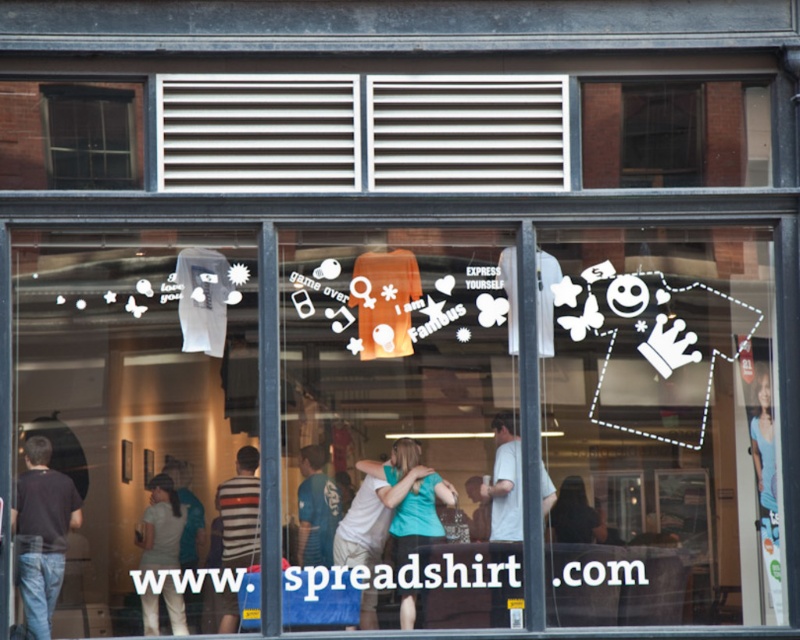
Who is lower down, white cotton shirt at lower left or white t-shirt at center?

white cotton shirt at lower left is lower down.

Is white cotton shirt at lower left to the right of white t-shirt at center from the viewer's perspective?

Incorrect, white cotton shirt at lower left is not on the right side of white t-shirt at center.

Between point (168, 605) and point (501, 477), which one is positioned behind?

Point (501, 477)

This screenshot has height=640, width=800. Find the location of `white cotton shirt at lower left`. white cotton shirt at lower left is located at coordinates tap(162, 525).

Does dark blue shirt at left have a greater height compared to white t-shirt at center?

Indeed, dark blue shirt at left has a greater height compared to white t-shirt at center.

Is dark blue shirt at left bigger than white t-shirt at center?

Yes, dark blue shirt at left is bigger than white t-shirt at center.

What do you see at coordinates (42, 532) in the screenshot? I see `dark blue shirt at left` at bounding box center [42, 532].

You are a GUI agent. You are given a task and a screenshot of the screen. Output one action in this format:
    pyautogui.click(x=<x>, y=<y>)
    Task: Click on the dark blue shirt at left
    
    Given the screenshot: What is the action you would take?
    pyautogui.click(x=42, y=532)

Which is more to the right, white t-shirt at center or blue t-shirt at center?

white t-shirt at center

Can you confirm if white t-shirt at center is positioned above blue t-shirt at center?

Yes.

In the scene shown: Measure the distance between point (518, 500) and camera.

The distance of point (518, 500) from camera is 8.26 meters.

What are the coordinates of `white t-shirt at center` in the screenshot? It's located at (504, 481).